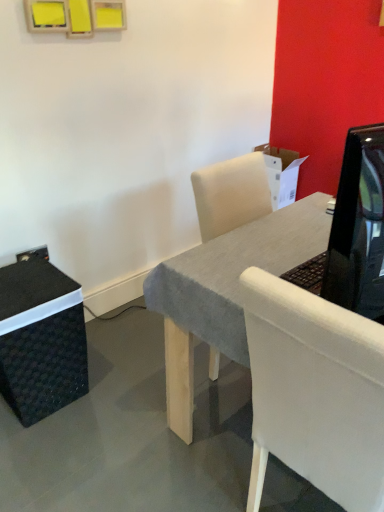
In order to face shiny black tv at right, should I rotate leftwards or rightwards?

You should look right and rotate roughly 25.607 degrees.

The image size is (384, 512). What do you see at coordinates (315, 391) in the screenshot?
I see `white fabric chair at center` at bounding box center [315, 391].

Identify the location of shiny black tv at right. (358, 227).

Is textured gray desk at center positioned with its back to black woven box at lower left?

Yes, textured gray desk at center is facing away from black woven box at lower left.

Visually, is textured gray desk at center positioned to the left or to the right of black woven box at lower left?

textured gray desk at center is positioned on black woven box at lower left's right side.

From a real-world perspective, which object rests below the other?

From a 3D spatial view, black woven box at lower left is below.

Choose the correct answer: Is textured gray desk at center inside black woven box at lower left or outside it?

textured gray desk at center is located beyond the bounds of black woven box at lower left.

From the image's perspective, is white fabric chair at center below textured gray desk at center?

Correct, white fabric chair at center appears lower than textured gray desk at center in the image.

Is white fabric chair at center oriented away from textured gray desk at center?

Yes.

What are the coordinates of `desk that appears above the white fabric chair at center (from the image's perspective)` in the screenshot? It's located at (224, 292).

From a real-world perspective, is white fabric chair at center physically above textured gray desk at center?

Yes, from a real-world perspective, white fabric chair at center is on top of textured gray desk at center.

From a real-world perspective, is white fabric chair at center positioned over black woven box at lower left based on gravity?

Yes, from a real-world perspective, white fabric chair at center is above black woven box at lower left.

From the image's perspective, is white fabric chair at center positioned above or below black woven box at lower left?

From the image's perspective, white fabric chair at center appears below black woven box at lower left.

Is white fabric chair at center not close to black woven box at lower left?

No, white fabric chair at center is not far from black woven box at lower left.

The image size is (384, 512). There is a black woven box at lower left. Identify the location of television above it (from a real-world perspective). coord(358,227).

From the picture: Is black woven box at lower left oriented away from shiny black tv at right?

No.

Considering the sizes of objects black woven box at lower left and shiny black tv at right in the image provided, who is bigger, black woven box at lower left or shiny black tv at right?

black woven box at lower left.

Can you tell me how much black woven box at lower left and shiny black tv at right differ in facing direction?

166 degrees separate the facing orientations of black woven box at lower left and shiny black tv at right.

Looking at this image, considering the relative sizes of textured gray desk at center and white fabric chair at center in the image provided, is textured gray desk at center shorter than white fabric chair at center?

Yes, textured gray desk at center is shorter than white fabric chair at center.

Is point (251, 259) positioned in front of point (336, 445)?

No, (251, 259) is further to viewer.

Does textured gray desk at center come behind white fabric chair at center?

Yes, textured gray desk at center is behind white fabric chair at center.

Is textured gray desk at center turned away from white fabric chair at center?

No.

From the image's perspective, which one is positioned lower, shiny black tv at right or white fabric chair at center?

From the image's view, white fabric chair at center is below.

Considering the positions of objects shiny black tv at right and white fabric chair at center in the image provided, who is more to the right, shiny black tv at right or white fabric chair at center?

Positioned to the right is white fabric chair at center.

From the picture: Can you tell me how much shiny black tv at right and white fabric chair at center differ in facing direction?

They differ by 76.2 degrees in their facing directions.

Is shiny black tv at right looking in the opposite direction of white fabric chair at center?

No, shiny black tv at right is not facing the opposite direction of white fabric chair at center.

Does textured gray desk at center appear on the right side of shiny black tv at right?

Indeed, textured gray desk at center is positioned on the right side of shiny black tv at right.

Can you confirm if textured gray desk at center is smaller than shiny black tv at right?

Incorrect, textured gray desk at center is not smaller in size than shiny black tv at right.

Is textured gray desk at center aimed at shiny black tv at right?

No, textured gray desk at center does not turn towards shiny black tv at right.

Identify the location of desk located in front of the black woven box at lower left. This screenshot has height=512, width=384. (224, 292).

Find the location of a particular element. The width and height of the screenshot is (384, 512). desk located above the white fabric chair at center (from the image's perspective) is located at coordinates (224, 292).

Looking at the image, which one is located further to textured gray desk at center, shiny black tv at right or black woven box at lower left?

Among the two, black woven box at lower left is located further to textured gray desk at center.

Based on their spatial positions, is white fabric chair at center or shiny black tv at right further from black woven box at lower left?

shiny black tv at right is positioned further to the anchor black woven box at lower left.

Which object lies further to the anchor point white fabric chair at center, black woven box at lower left or shiny black tv at right?

Among the two, black woven box at lower left is located further to white fabric chair at center.

When comparing their distances from white fabric chair at center, does shiny black tv at right or textured gray desk at center seem closer?

shiny black tv at right is positioned closer to the anchor white fabric chair at center.

Based on their spatial positions, is white fabric chair at center or textured gray desk at center closer to shiny black tv at right?

Based on the image, white fabric chair at center appears to be nearer to shiny black tv at right.

Based on their spatial positions, is black woven box at lower left or white fabric chair at center closer to textured gray desk at center?

Based on the image, white fabric chair at center appears to be nearer to textured gray desk at center.

Which object lies nearer to the anchor point black woven box at lower left, textured gray desk at center or white fabric chair at center?

Among the two, textured gray desk at center is located nearer to black woven box at lower left.

From the image, which object appears to be nearer to textured gray desk at center, white fabric chair at center or black woven box at lower left?

The object closer to textured gray desk at center is white fabric chair at center.

Identify the location of desk between shiny black tv at right and white fabric chair at center in the up-down direction. (224, 292).

Where is `television located between black woven box at lower left and textured gray desk at center in the left-right direction`? The image size is (384, 512). television located between black woven box at lower left and textured gray desk at center in the left-right direction is located at coordinates (358, 227).

Locate an element on the screen. Image resolution: width=384 pixels, height=512 pixels. chair between black woven box at lower left and textured gray desk at center in the horizontal direction is located at coordinates (315, 391).

This screenshot has height=512, width=384. Find the location of `television situated between black woven box at lower left and white fabric chair at center from left to right`. television situated between black woven box at lower left and white fabric chair at center from left to right is located at coordinates (358, 227).